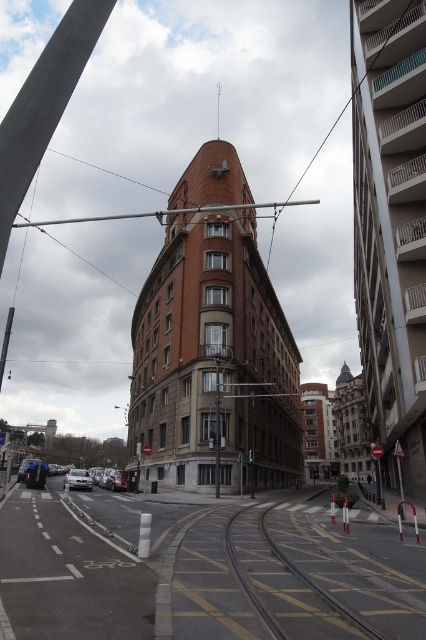
You are a pedestrian standing on the sidewalk and want to cross the street to reach the large curved building with a reddish brown facade. You see the yellow textured train track at center and the silver metallic car at lower left. Which object should you avoid stepping on to stay safe?

You should avoid stepping on the yellow textured train track at center because it is located to the right of the silver metallic car at lower left, meaning it is in the middle of the street where trains operate, posing a safety hazard.

You are a pedestrian standing on the sidewalk and want to cross the street to reach the large curved building. The yellow textured train track at center and the silver metallic sedan at lower left are in your path. Which object is closer to you as you start crossing?

The silver metallic sedan at lower left is closer to you because the yellow textured train track at center is above it, meaning the sedan is positioned lower and nearer in the path.